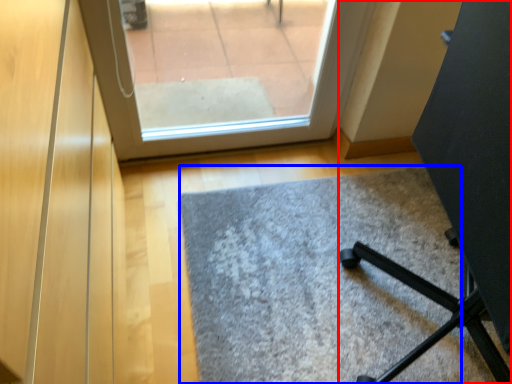
Question: Which of the following is the farthest to the observer, furniture (highlighted by a red box) or door (highlighted by a blue box)?

Choices:
 (A) furniture
 (B) door

Answer: (B)